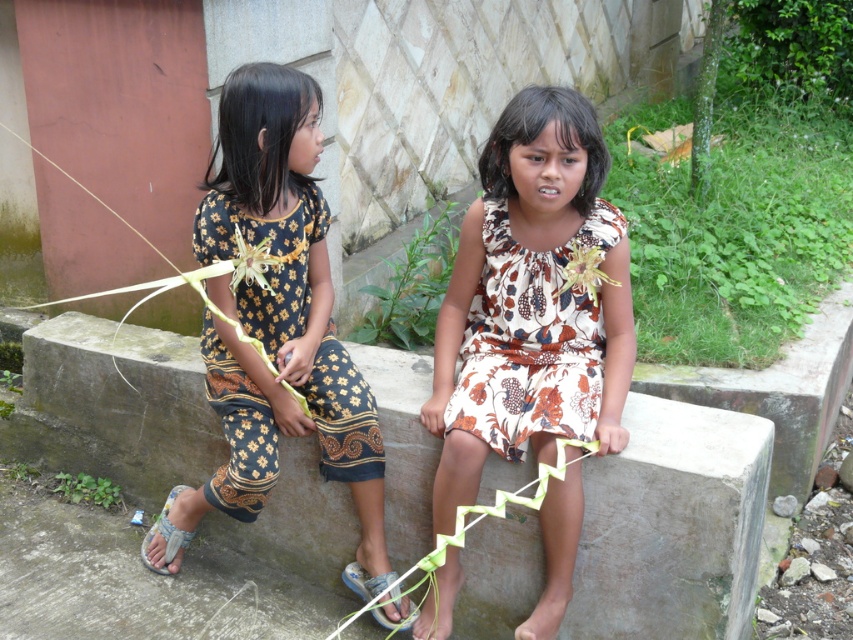
Question: Estimate the real-world distances between objects in this image. Which object is closer to the gray concrete at center?

Choices:
 (A) gray fabric sandal at lower left
 (B) printed fabric dress at center

Answer: (B)

Question: Is gray concrete at center bigger than printed fabric dress at center?

Choices:
 (A) yes
 (B) no

Answer: (A)

Question: Is gray concrete at center closer to the viewer compared to blue fabric sandal at lower center?

Choices:
 (A) yes
 (B) no

Answer: (A)

Question: Can you confirm if gray concrete at center is thinner than gray fabric sandal at lower left?

Choices:
 (A) yes
 (B) no

Answer: (B)

Question: Which is farther from the gray concrete at center?

Choices:
 (A) blue fabric sandal at lower center
 (B) dark blue batik dress at left
 (C) gray fabric sandal at lower left
 (D) printed fabric dress at center

Answer: (C)

Question: Which point is closer to the camera?

Choices:
 (A) dark blue batik dress at left
 (B) gray concrete at center
 (C) gray fabric sandal at lower left

Answer: (B)